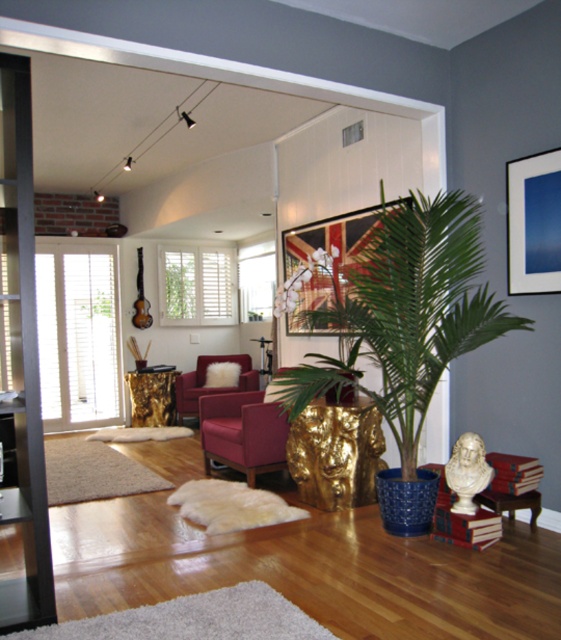
You are standing in the living room and want to reach the two points marked in the image. Which point, point (274, 298) or point (530, 262), is closer to you?

Point (274, 298) is closer to you because it is further to the camera than point (530, 262).

You are planning to place a rectangular coffee table between the velvet burgundy armchair at center and the velvet maroon armchair at center. Considering their widths, which armchair will have more space on its side after placing the table?

The velvet maroon armchair at center has a greater width than the velvet burgundy armchair at center. Therefore, placing the coffee table between them would leave more space on the side of the velvet maroon armchair at center.